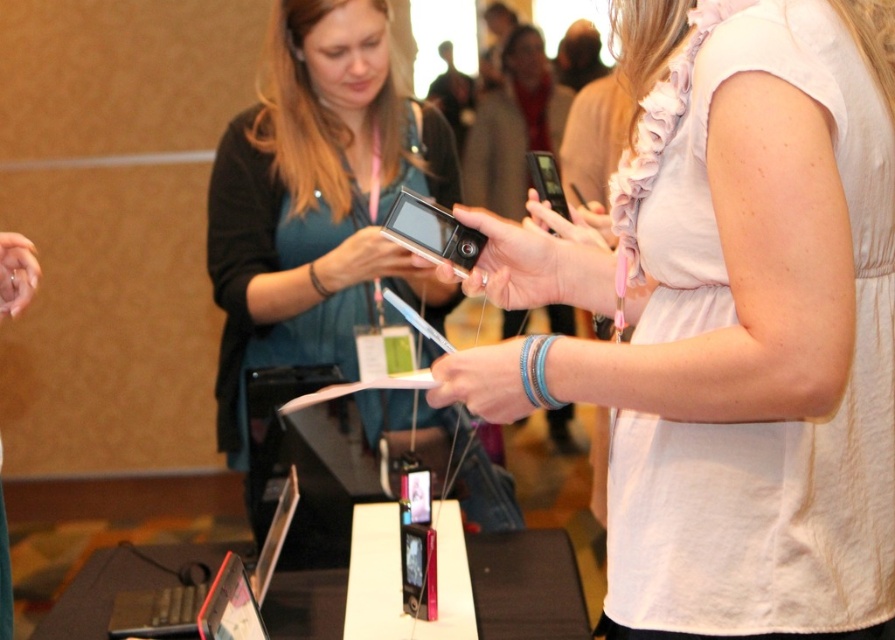
Question: Is white matte shirt at center bigger than matte black tablet at lower left?

Choices:
 (A) yes
 (B) no

Answer: (A)

Question: Which of the following is the farthest from the observer?

Choices:
 (A) black glossy laptop at lower left
 (B) matte black tablet at lower left

Answer: (A)

Question: Which point is closer to the camera?

Choices:
 (A) white matte shirt at center
 (B) silver metallic camera at center
 (C) matte black tablet at lower left

Answer: (A)

Question: Is white matte shirt at center below matte black camera at center?

Choices:
 (A) no
 (B) yes

Answer: (B)

Question: Which of the following is the closest to the observer?

Choices:
 (A) silver metallic camera at center
 (B) matte black camera at center
 (C) black glossy laptop at lower left
 (D) white matte shirt at center

Answer: (D)

Question: Is white matte shirt at center thinner than matte black camera at center?

Choices:
 (A) yes
 (B) no

Answer: (A)